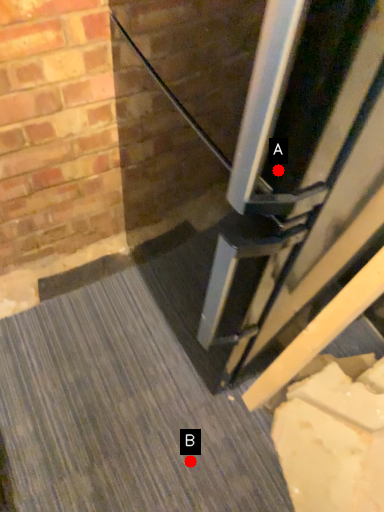
Question: Two points are circled on the image, labeled by A and B beside each circle. Which point is closer to the camera taking this photo?

Choices:
 (A) A is closer
 (B) B is closer

Answer: (A)